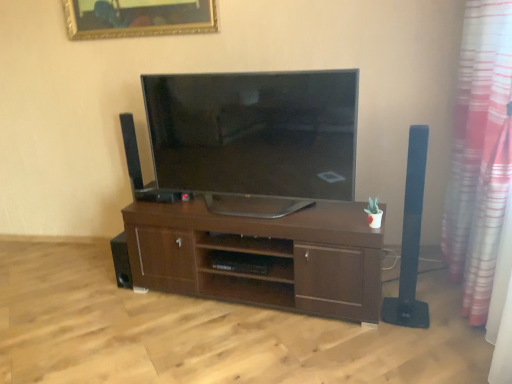
The image size is (512, 384). I want to click on vacant area to the right of black matte speaker at right, marked as the 1th speaker in a right-to-left arrangement, so click(x=443, y=309).